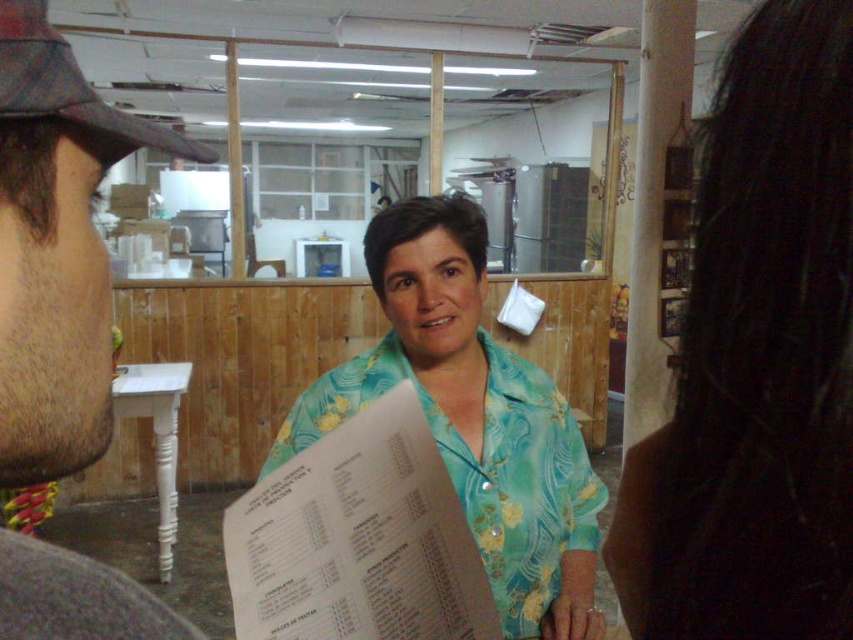
Question: Where is blue floral shirt at center located in relation to turquoise floral shirt at center in the image?

Choices:
 (A) above
 (B) below

Answer: (A)

Question: Which object is positioned closest to the turquoise floral shirt at center?

Choices:
 (A) blue floral shirt at center
 (B) brown fuzzy hat at left

Answer: (A)

Question: Can you confirm if brown fuzzy hat at left is thinner than turquoise floral shirt at center?

Choices:
 (A) yes
 (B) no

Answer: (A)

Question: Which object is positioned closest to the turquoise floral shirt at center?

Choices:
 (A) blue floral shirt at center
 (B) brown fuzzy hat at left

Answer: (A)

Question: Can you confirm if brown fuzzy hat at left is positioned to the right of turquoise floral shirt at center?

Choices:
 (A) no
 (B) yes

Answer: (A)

Question: Which point is closer to the camera?

Choices:
 (A) turquoise floral shirt at center
 (B) brown fuzzy hat at left

Answer: (B)